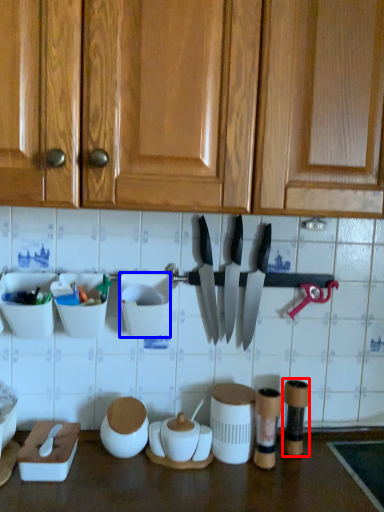
Question: Which point is closer to the camera, tableware (highlighted by a red box) or tableware (highlighted by a blue box)?

Choices:
 (A) tableware
 (B) tableware

Answer: (B)